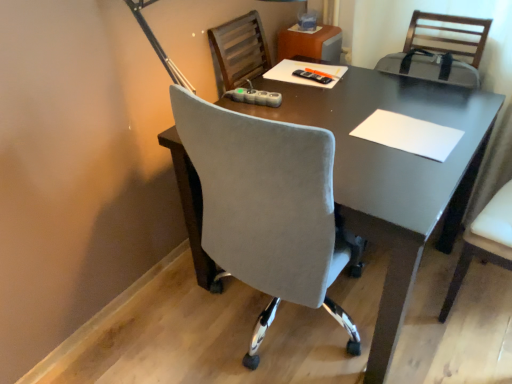
At what (x,y) coordinates should I click in order to perform the action: click on vacant space underneath white leather chair at right (from a real-world perspective). Please return your answer as a coordinate pair (x, y). Looking at the image, I should click on (487, 301).